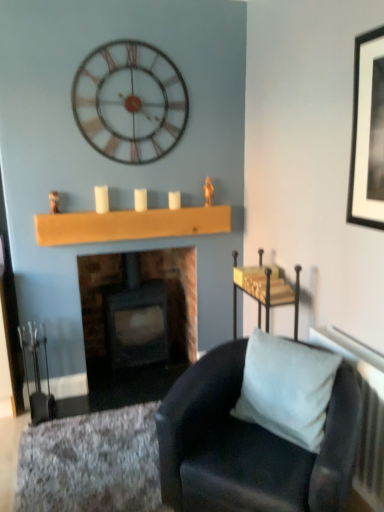
Question: Is suede-like black chair at lower right positioned behind white matte candle at center, placed as the 1th candle when sorted from left to right?

Choices:
 (A) no
 (B) yes

Answer: (A)

Question: Can white matte candle at center, placed as the 1th candle when sorted from left to right, be found inside suede-like black chair at lower right?

Choices:
 (A) no
 (B) yes

Answer: (A)

Question: Is suede-like black chair at lower right facing away from white matte candle at center, placed as the 1th candle when sorted from left to right?

Choices:
 (A) yes
 (B) no

Answer: (B)

Question: Is suede-like black chair at lower right aimed at white matte candle at center, placed as the 1th candle when sorted from left to right?

Choices:
 (A) no
 (B) yes

Answer: (A)

Question: Is there a large distance between suede-like black chair at lower right and white matte candle at center, placed as the 1th candle when sorted from left to right?

Choices:
 (A) yes
 (B) no

Answer: (A)

Question: Considering the relative sizes of suede-like black chair at lower right and white matte candle at center, arranged as the 3th candle when viewed from the right, in the image provided, is suede-like black chair at lower right wider than white matte candle at center, arranged as the 3th candle when viewed from the right,?

Choices:
 (A) no
 (B) yes

Answer: (B)

Question: Is dark gray stone fireplace at center outside of wooden plank at center?

Choices:
 (A) yes
 (B) no

Answer: (A)

Question: From the image's perspective, would you say dark gray stone fireplace at center is shown under wooden plank at center?

Choices:
 (A) yes
 (B) no

Answer: (A)

Question: Is dark gray stone fireplace at center surrounding wooden plank at center?

Choices:
 (A) yes
 (B) no

Answer: (B)

Question: From a real-world perspective, is dark gray stone fireplace at center positioned over wooden plank at center based on gravity?

Choices:
 (A) no
 (B) yes

Answer: (A)

Question: Considering the relative sizes of dark gray stone fireplace at center and wooden plank at center in the image provided, is dark gray stone fireplace at center shorter than wooden plank at center?

Choices:
 (A) yes
 (B) no

Answer: (B)

Question: Does dark gray stone fireplace at center have a larger size compared to wooden plank at center?

Choices:
 (A) no
 (B) yes

Answer: (B)

Question: Is textured gray rug at lower left positioned far away from white matte candle at center, the 1th candle in the right-to-left sequence?

Choices:
 (A) yes
 (B) no

Answer: (A)